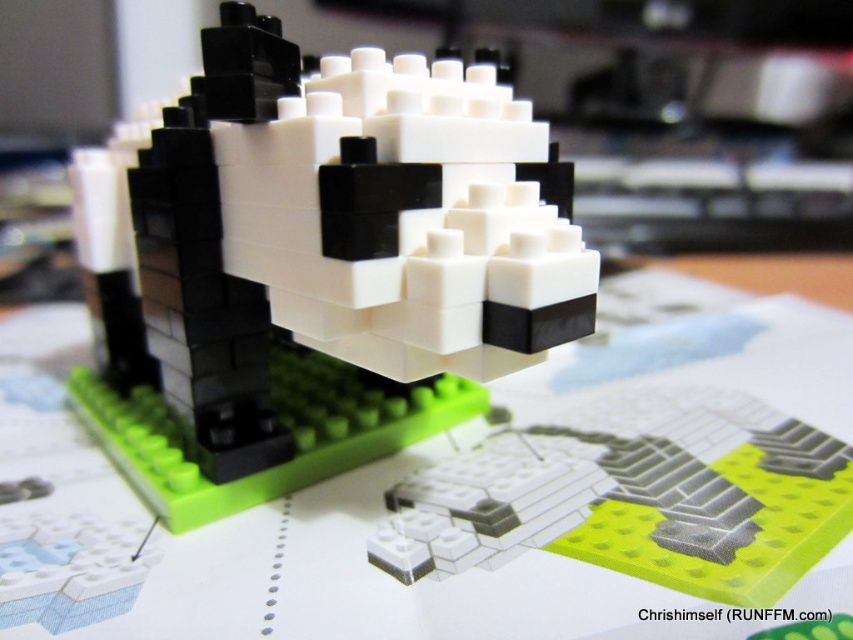
Question: Among these objects, which one is nearest to the camera?

Choices:
 (A) black matte lego dog at center
 (B) green plastic table at center

Answer: (B)

Question: Is green plastic table at center to the right of black matte lego dog at center from the viewer's perspective?

Choices:
 (A) yes
 (B) no

Answer: (A)

Question: Does green plastic table at center have a lesser width compared to black matte lego dog at center?

Choices:
 (A) no
 (B) yes

Answer: (A)

Question: Which of the following is the farthest from the observer?

Choices:
 (A) black matte lego dog at center
 (B) green plastic table at center

Answer: (A)

Question: From the image, what is the correct spatial relationship of green plastic table at center in relation to black matte lego dog at center?

Choices:
 (A) below
 (B) above

Answer: (A)